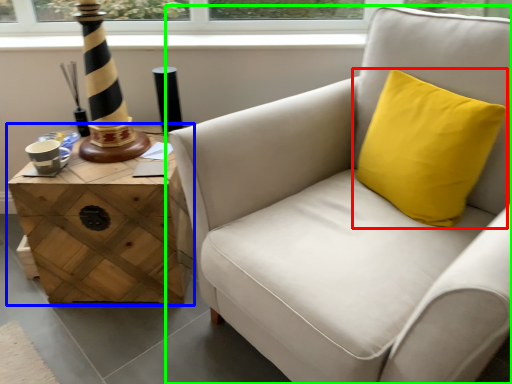
Question: Based on their relative distances, which object is farther from pillow (highlighted by a red box)? Choose from table (highlighted by a blue box) and chair (highlighted by a green box).

Choices:
 (A) table
 (B) chair

Answer: (A)